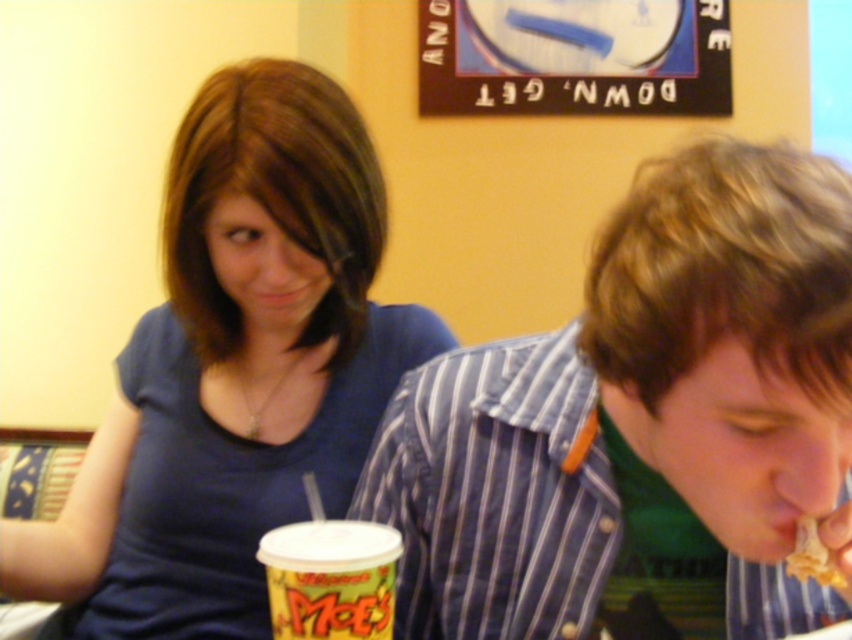
You are taking a photo of two people sitting at a table. There are two points of interest marked in the image. The first point is at coordinates point (774, 566) and the second is at point (194, 230). Which point is closer to the camera?

Point (774, 566) is closer to the camera than point (194, 230).

You are a photographer standing at the camera position. You want to take a photo of the scene but need to ensure that the subject at point (727,250) is in focus. What is the minimum distance you need to adjust your focus to capture this subject clearly?

The minimum distance adjustment needed is 16.50 inches because the subject at point (727,250) is exactly 16.50 inches away from the camera.

You are a delivery person who needs to place a small package between the striped cotton shirt at right and the matte blue shirt at upper left. The package is 12 inches long. Will it fit in the space between them?

The distance between the striped cotton shirt at right and the matte blue shirt at upper left is 13.47 inches. Since the package is 12 inches long, it will fit in the space between them as there is enough room.